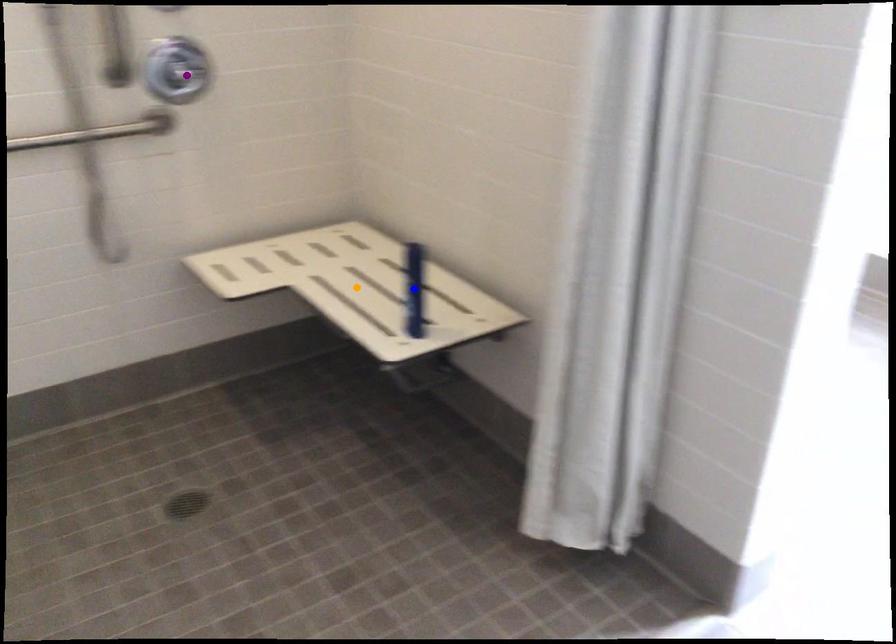
Order these from nearest to farthest:
- orange point
- blue point
- purple point

blue point → purple point → orange point